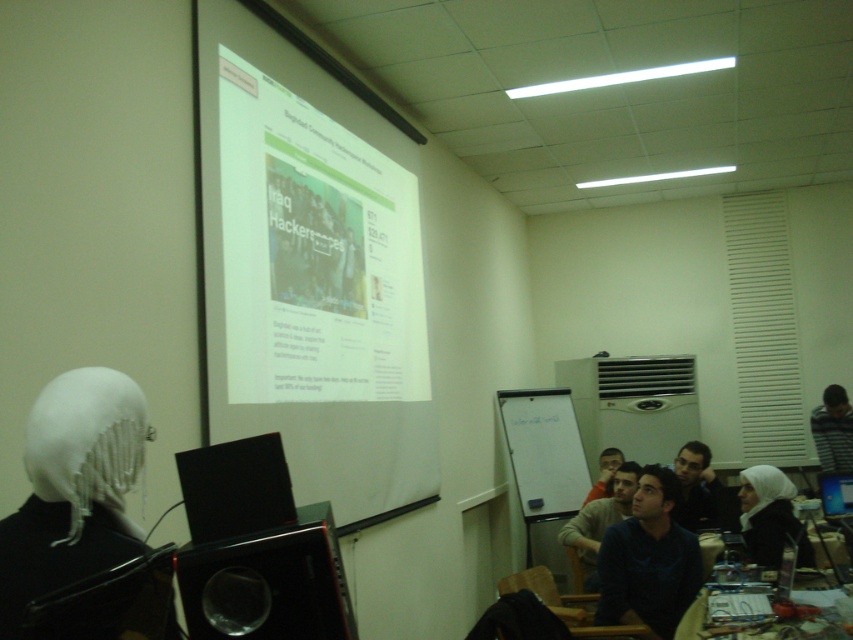
You are organizing a presentation in this room and need to place a 1.2 meter wide banner between the white matte headscarf at left and the whiteboard at center. Will the banner fit horizontally between them?

The white matte headscarf at left is narrower than the whiteboard at center, but the distance between them isn not specified. Without knowing the space between the two objects, it is impossible to determine if the banner will fit.

You are organizing a presentation in the classroom and need to seat two participants wearing dark blue sweater at center and dark blue shirt at lower right. Given their clothing sizes, which participant might require a wider chair to accommodate their clothing?

The dark blue sweater at center has a larger width than the dark blue shirt at lower right, so the participant wearing the dark blue sweater at center would need a wider chair to accommodate their clothing.